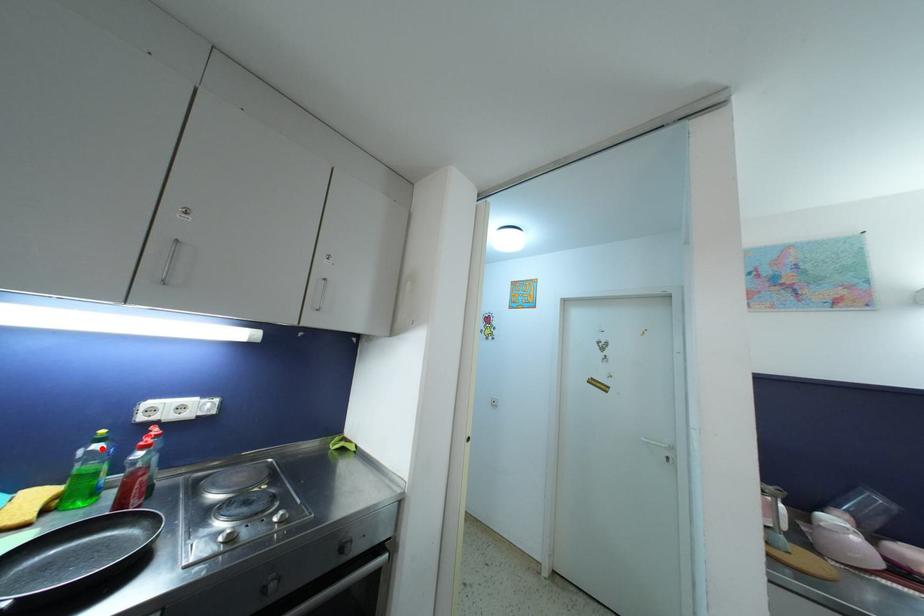
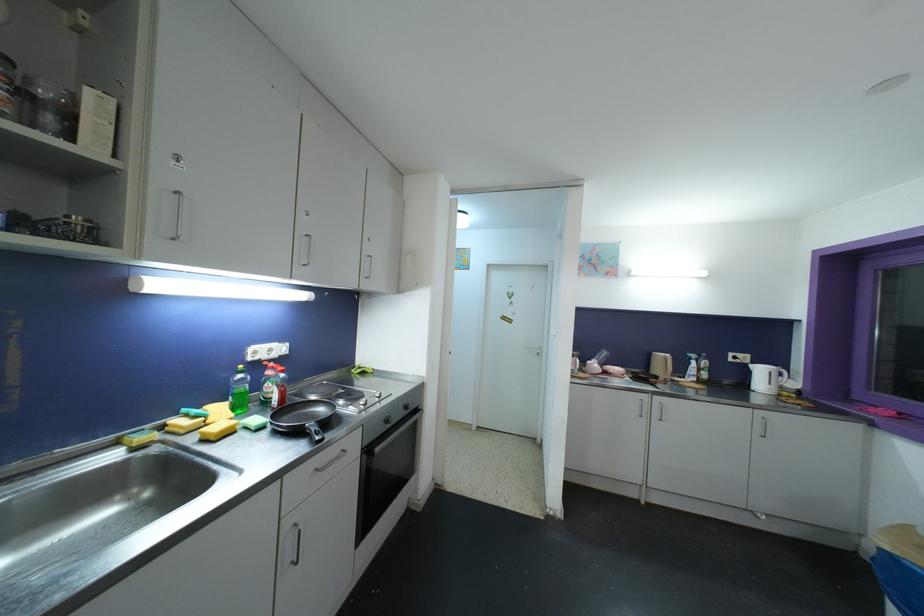
Question: I am providing you with two images of the same scene from different viewpoints. Given a red point in image1, look at the same physical point in image2. Is it:

Choices:
 (A) Closer to the viewpoint
 (B) Farther from the viewpoint

Answer: (B)